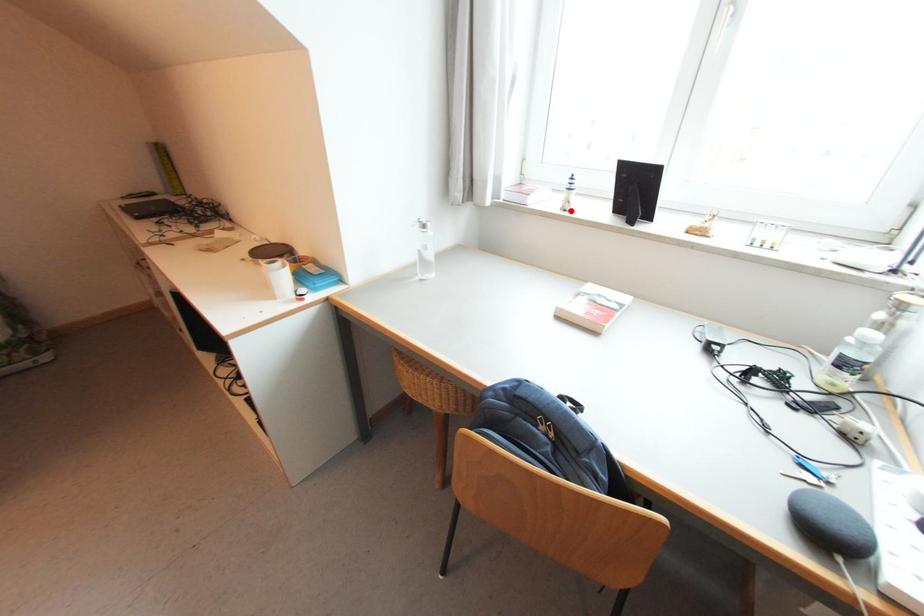
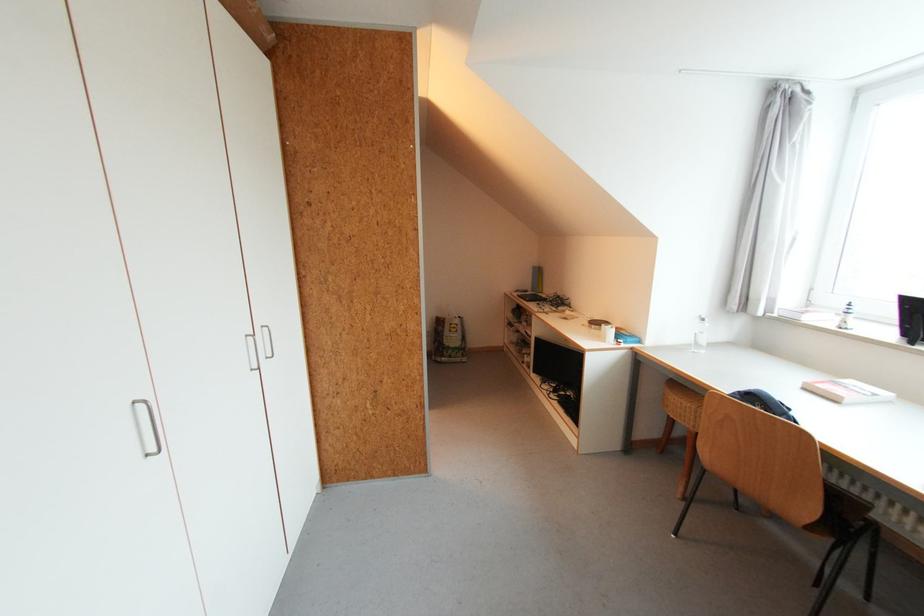
Where in the second image is the point corresponding to the highlighted location from the first image?

(845, 329)